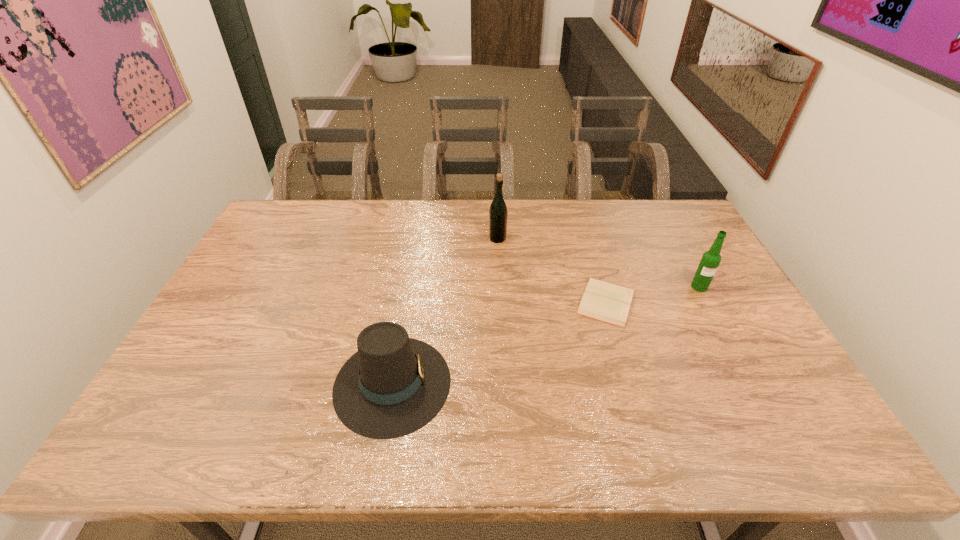
Where is `the farthest object`? Image resolution: width=960 pixels, height=540 pixels. the farthest object is located at coordinates (498, 213).

This screenshot has height=540, width=960. I want to click on the second object from left to right, so click(498, 213).

The width and height of the screenshot is (960, 540). Find the location of `the nearer beer bottle`. the nearer beer bottle is located at coordinates click(711, 259).

The width and height of the screenshot is (960, 540). Find the location of `the right beer bottle`. the right beer bottle is located at coordinates (711, 259).

What are the coordinates of `the second shortest object` in the screenshot? It's located at (394, 385).

The image size is (960, 540). Identify the location of hat. (394, 385).

Image resolution: width=960 pixels, height=540 pixels. Find the location of `diary`. diary is located at coordinates (606, 302).

Find the location of a particular element. the third object from left to right is located at coordinates (606, 302).

Identify the location of free space located on the front of the tallest object. The image size is (960, 540). (501, 312).

In order to click on vacant area located 0.170m on the label of the second tallest object in this screenshot , I will do `click(726, 335)`.